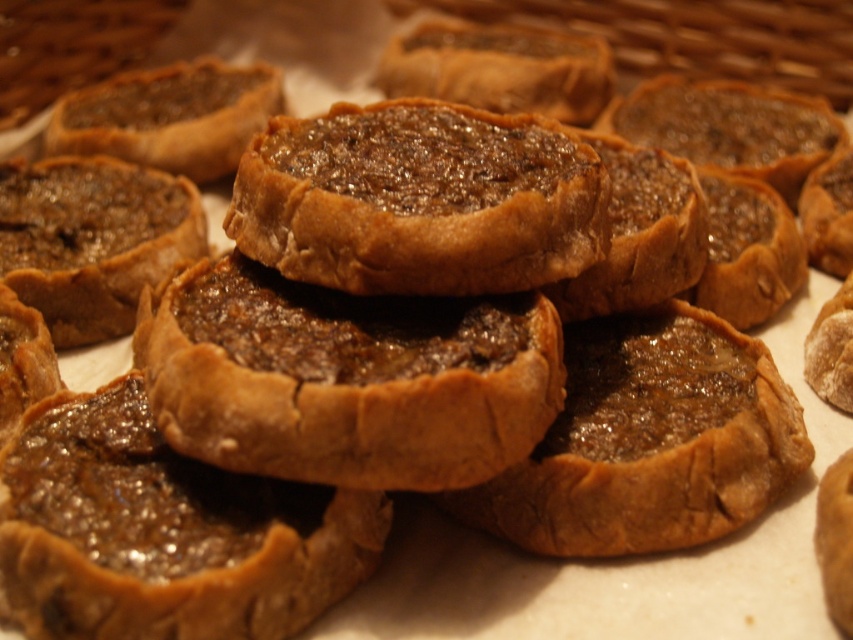
Question: Which object is the closest to the baked golden-brown tartlet at center?

Choices:
 (A) shiny brown pastry at center
 (B) brown crumbly pastry at center
 (C) brown crumbly tart at center

Answer: (C)

Question: Which point is farther to the camera?

Choices:
 (A) brown crumbly tart at center
 (B) brown crumbly pastry at center
 (C) baked golden-brown tartlet at center
 (D) shiny brown pastry at center

Answer: (B)

Question: Which of the following is the closest to the observer?

Choices:
 (A) baked golden-brown tartlet at center
 (B) shiny brown pastry at center
 (C) brown crumbly tart at center
 (D) brown crumbly pastry at center

Answer: (B)

Question: Is shiny brown pastry at center smaller than brown crumbly tart at center?

Choices:
 (A) yes
 (B) no

Answer: (A)

Question: Can you confirm if baked golden-brown tartlet at center is wider than shiny brown pastry at center?

Choices:
 (A) no
 (B) yes

Answer: (B)

Question: Is brown crumbly tart at center positioned behind brown crumbly pastry at center?

Choices:
 (A) no
 (B) yes

Answer: (A)